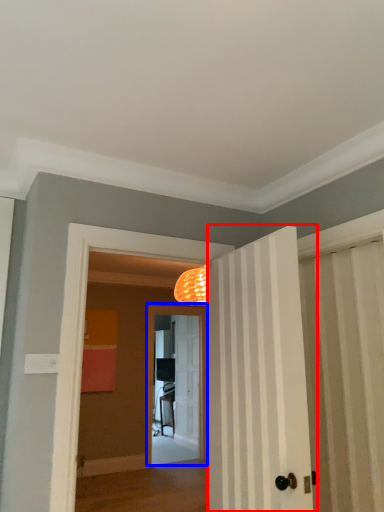
Question: Among these objects, which one is nearest to the camera, door (highlighted by a red box) or screen door (highlighted by a blue box)?

Choices:
 (A) door
 (B) screen door

Answer: (A)